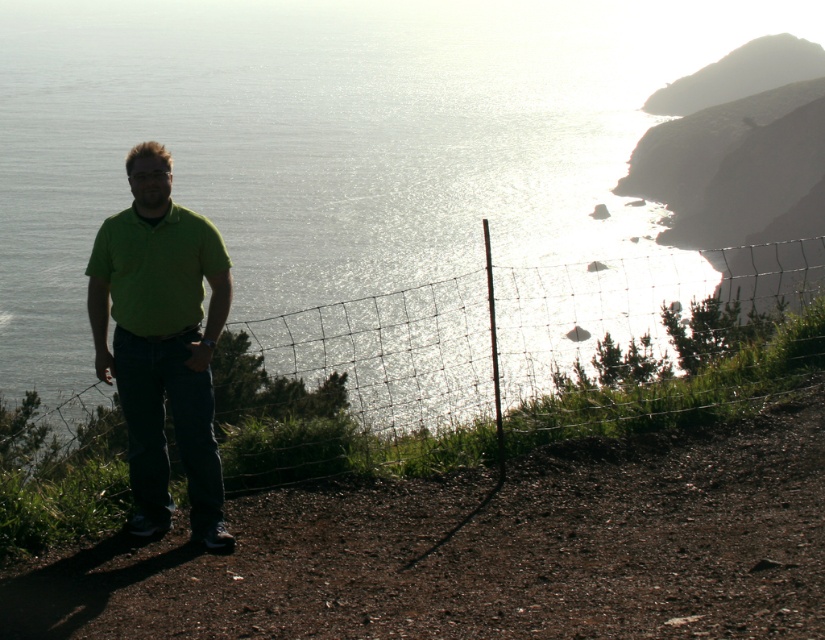
Can you confirm if glistening silver water at center is shorter than green matte shirt at center?

No.

Who is more distant from viewer, (238, 291) or (219, 317)?

Positioned behind is point (238, 291).

At what (x,y) coordinates should I click in order to perform the action: click on glistening silver water at center. Please return your answer as a coordinate pair (x, y). Looking at the image, I should click on (330, 140).

Between point (519, 200) and point (640, 616), which one is positioned in front?

Point (640, 616) is more forward.

Who is higher up, glistening silver water at center or green grass at lower left?

glistening silver water at center

Where is `glistening silver water at center`? This screenshot has width=825, height=640. glistening silver water at center is located at coordinates [330, 140].

Can you confirm if green grass at lower left is positioned below green matte shirt at center?

Yes.

Is point (184, 605) behind point (132, 477)?

No, it is in front of (132, 477).

Is point (762, 605) in front of point (151, 332)?

Yes.

Where is `green grass at lower left`? The width and height of the screenshot is (825, 640). green grass at lower left is located at coordinates (484, 548).